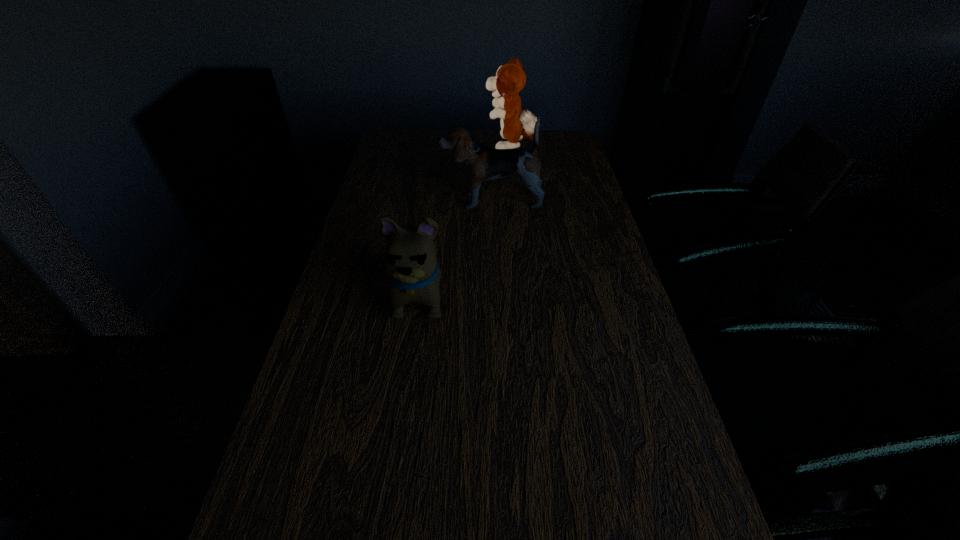
Locate an element on the screen. The image size is (960, 540). object present at the far edge is located at coordinates (510, 79).

Identify the location of object present at the left edge. (410, 263).

At what (x,y) coordinates should I click in order to perform the action: click on object present at the right edge. Please return your answer as a coordinate pair (x, y). Looking at the image, I should click on (510, 79).

Locate an element on the screen. Image resolution: width=960 pixels, height=540 pixels. object that is at the far right corner is located at coordinates (510, 79).

Find the location of a particular element. vacant space at the left edge of the desktop is located at coordinates (365, 214).

This screenshot has width=960, height=540. In order to click on free space at the right edge in this screenshot , I will do `click(620, 326)`.

What are the coordinates of `unoccupied area between the nearest puppy and the second nearest puppy` in the screenshot? It's located at (456, 248).

Locate an element on the screen. free space between the second nearest object and the nearest object is located at coordinates (456, 248).

You are a GUI agent. You are given a task and a screenshot of the screen. Output one action in this format:
    pyautogui.click(x=<x>, y=<y>)
    Task: Click on the empty space that is in between the farthest puppy and the nearest object
    Image resolution: width=960 pixels, height=540 pixels.
    Given the screenshot: What is the action you would take?
    pyautogui.click(x=465, y=221)

This screenshot has width=960, height=540. Identify the location of free area in between the nearest object and the farthest object. pos(465,221).